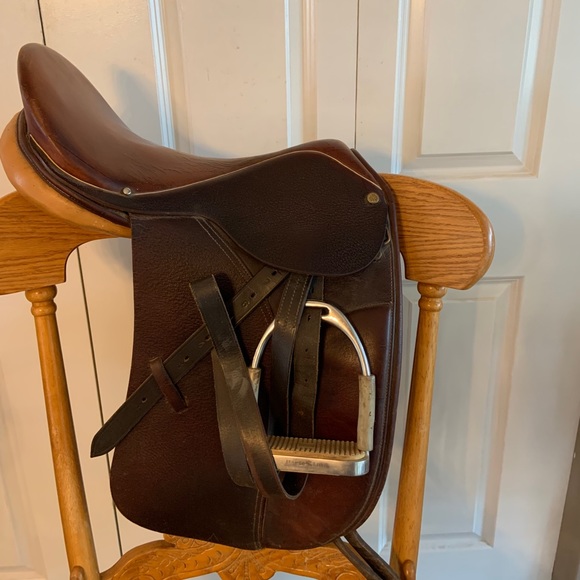
Locate an element on the screen. curved seat is located at coordinates (78, 102), (229, 164).